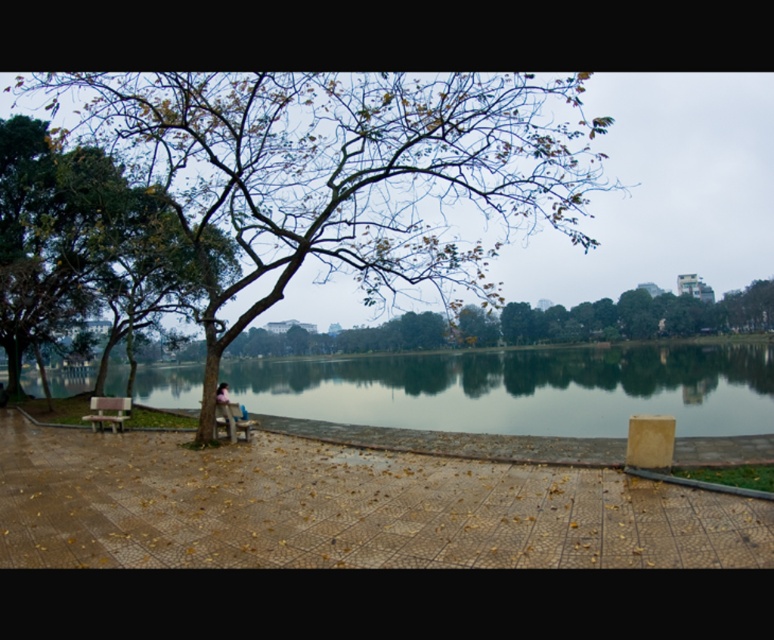
Between point (505, 147) and point (67, 291), which one is positioned in front?

Positioned in front is point (505, 147).

Can you confirm if green leafy tree at center is bigger than green leafy tree at left?

Yes, green leafy tree at center is bigger than green leafy tree at left.

Locate an element on the screen. The width and height of the screenshot is (774, 640). green leafy tree at center is located at coordinates (341, 173).

Identify the location of green leafy tree at center. Image resolution: width=774 pixels, height=640 pixels. (341, 173).

Between point (740, 420) and point (127, 401), which one is positioned behind?

Point (740, 420)

Does green reflective water at center have a greater width compared to wooden bench at lower left?

Yes, green reflective water at center is wider than wooden bench at lower left.

This screenshot has width=774, height=640. I want to click on green reflective water at center, so click(x=522, y=388).

At what (x,y) coordinates should I click in order to perform the action: click on green reflective water at center. Please return your answer as a coordinate pair (x, y). Looking at the image, I should click on (522, 388).

Which is above, green leafy tree at center or green reflective water at center?

green leafy tree at center is higher up.

How distant is green leafy tree at center from green reflective water at center?

The distance of green leafy tree at center from green reflective water at center is 9.89 meters.

This screenshot has height=640, width=774. Describe the element at coordinates (341, 173) in the screenshot. I see `green leafy tree at center` at that location.

You are a GUI agent. You are given a task and a screenshot of the screen. Output one action in this format:
    pyautogui.click(x=<x>, y=<y>)
    Task: Click on the green leafy tree at center
    The height and width of the screenshot is (640, 774).
    Given the screenshot: What is the action you would take?
    pyautogui.click(x=341, y=173)